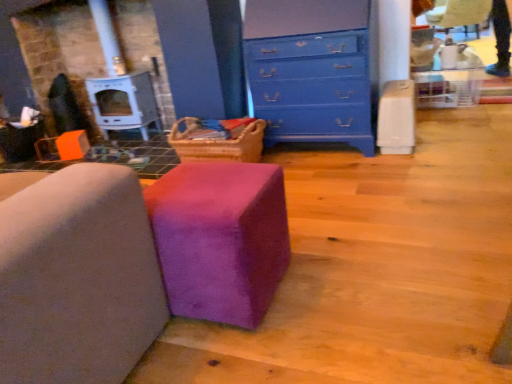
Identify the location of vacant area that lies in front of purple fuzzy ottoman at center, marked as the second furniture in a left-to-right arrangement. This screenshot has width=512, height=384. [247, 351].